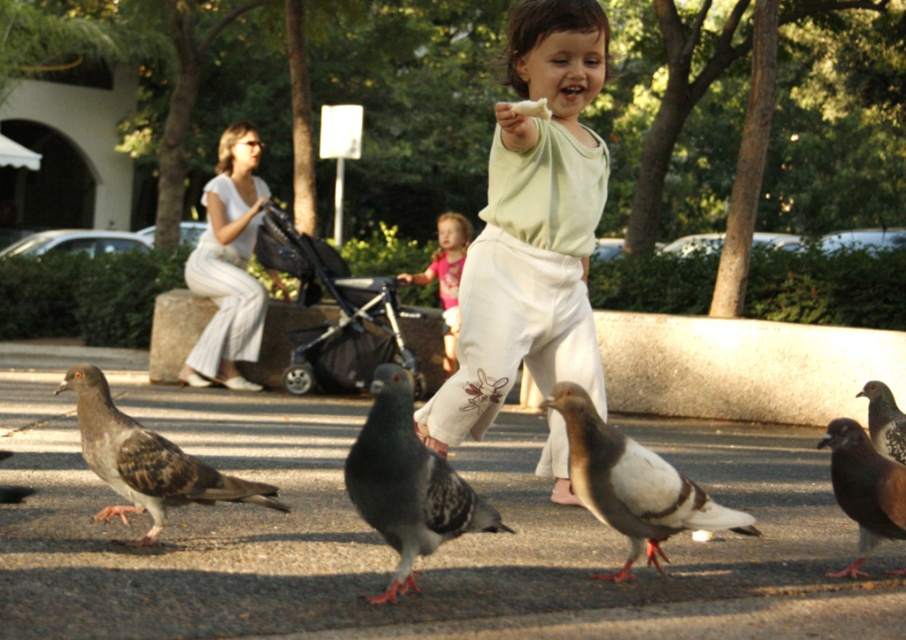
You are a photographer trying to capture a photo of the gray speckled pigeon at center and the white cotton pants at left. From the photographer perspective, which object is positioned to the right side?

The gray speckled pigeon at center is positioned to the right of the white cotton pants at left.

You are a photographer trying to capture a closeup of the gray speckled pigeon at lower left without the white cotton pants at left blocking the view. Can you adjust your position to achieve this?

The white cotton pants at left is positioned on the left side of gray speckled pigeon at lower left. To avoid blocking the view, move to the left side of the pigeon so the pants are out of frame.

You are standing in the park and want to know how far the point at coordinates (220, 349) is from you. Can you determine the distance?

The distance of point (220, 349) from the viewer is 14.64 meters.